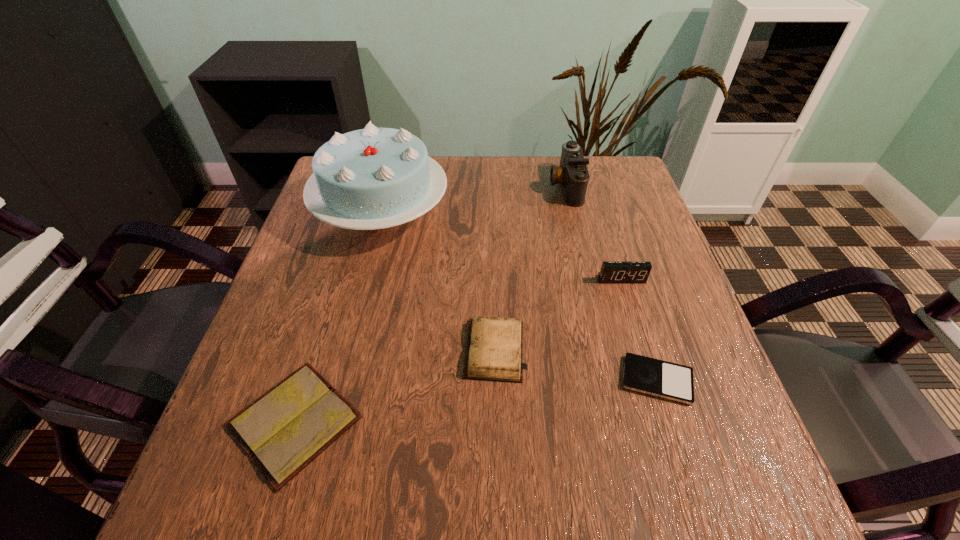
I want to click on blank space located on the lens of the camera, so click(x=491, y=186).

At what (x,y) coordinates should I click in order to perform the action: click on free space located 0.080m on the lens of the camera. Please return your answer as a coordinate pair (x, y). Looking at the image, I should click on (520, 186).

Identify the location of free space located 0.180m on the lens of the camera. (484, 186).

Find the location of a particular element. The height and width of the screenshot is (540, 960). free space located on the front-facing side of the third tallest object is located at coordinates (669, 435).

The height and width of the screenshot is (540, 960). Identify the location of vacant space located 0.260m on the right of the fourth object from right to left. (662, 350).

I want to click on free space located on the right of the shorter diary, so click(x=488, y=422).

Locate an element on the screen. Image resolution: width=960 pixels, height=540 pixels. vacant space located on the left of the iPod is located at coordinates (537, 380).

Where is `birthday cake that is at the far edge`? birthday cake that is at the far edge is located at coordinates (373, 178).

Where is `camera located at the far edge`? The image size is (960, 540). camera located at the far edge is located at coordinates (572, 174).

At what (x,y) coordinates should I click in order to perform the action: click on object present at the near edge. Please return your answer as a coordinate pair (x, y). This screenshot has width=960, height=540. Looking at the image, I should click on (284, 430).